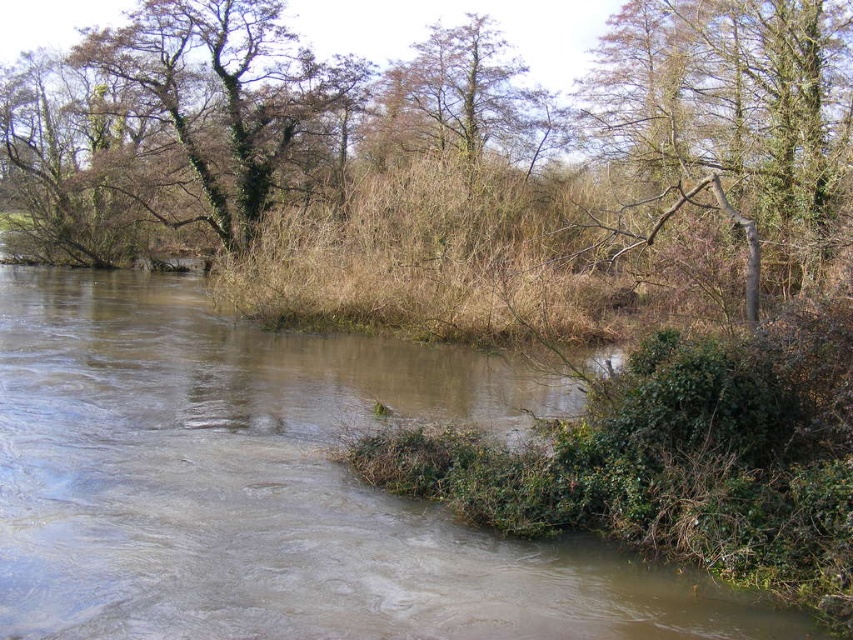
You are a bird flying over the river and want to land on a tree. Which tree is closer to the sky, the brown leafy tree at upper center or the brown rough tree at upper right?

The brown leafy tree at upper center is located above the brown rough tree at upper right, so it is closer to the sky.

You are standing at the edge of the river and want to cross to the other side. There is a point marked at coordinates (277, 486) which is the brown muddy river at center. Can you safely cross the river at that point?

The point at coordinates (277, 486) indicates the brown muddy river at center. Since the river has muddy and turbulent water, it may be unsafe to cross there due to the potential for slippery conditions and strong currents.

You are standing at the point with coordinates point [618,60] and want to walk to the point with coordinates point [614,70]. According to the scene description, will you be able to see the destination point from your current position?

Point [614,70] is behind point [618,60], so you will not be able to see the destination point from your current position.